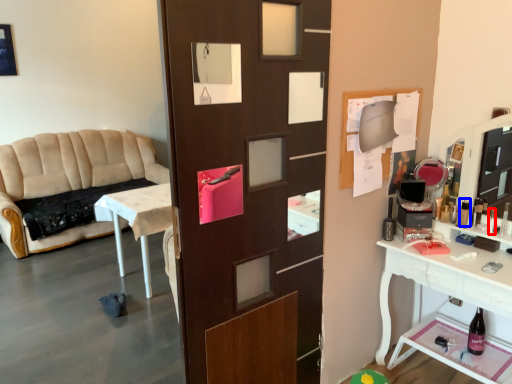
Question: Which object is closer to the camera taking this photo, toiletry (highlighted by a red box) or toiletry (highlighted by a blue box)?

Choices:
 (A) toiletry
 (B) toiletry

Answer: (A)